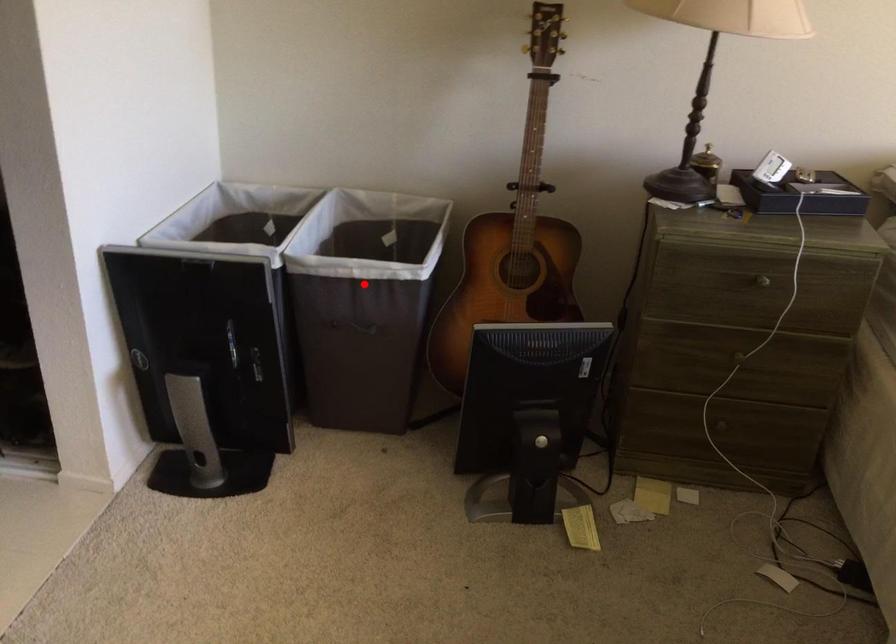
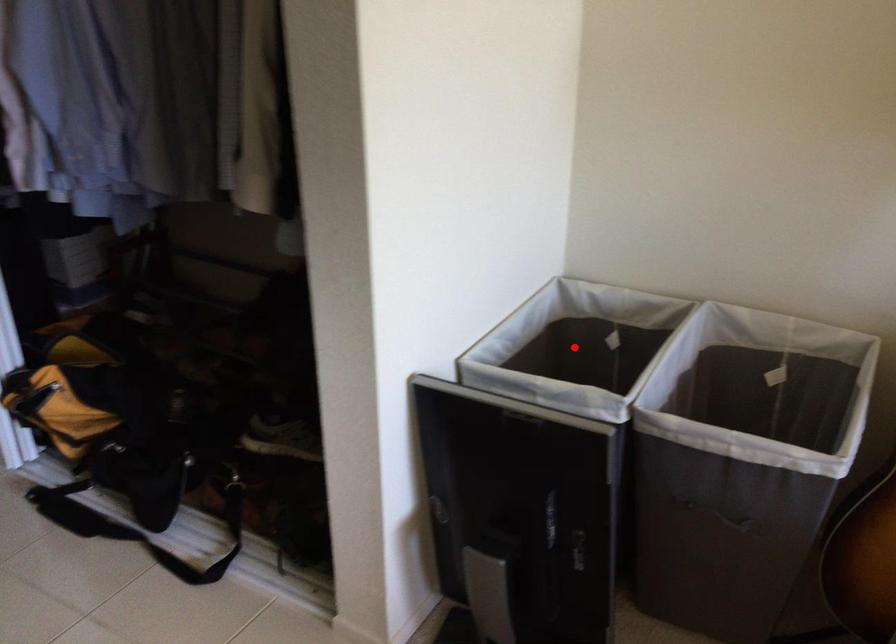
I am providing you with two images of the same scene from different viewpoints. A red point is marked on the first image and another point is marked on the second image. Does the point marked in image1 correspond to the same location as the one in image2?

No